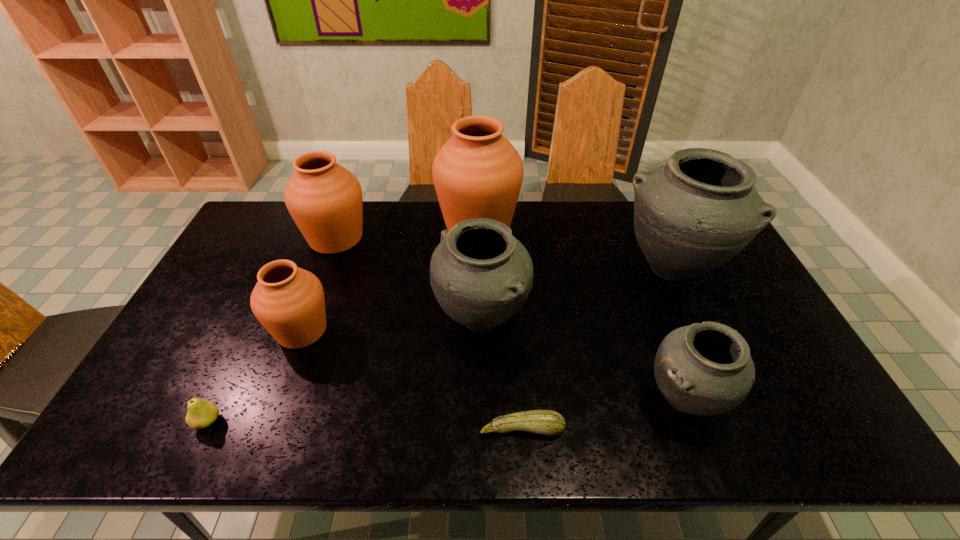
Identify the location of vacant point located between the second smallest brown urn and the biggest brown urn. Image resolution: width=960 pixels, height=540 pixels. (407, 232).

Locate an element on the screen. free space between the nearest black urn and the second biggest brown urn is located at coordinates (510, 319).

Where is `free point between the second biggest brown urn and the green zucchini`? The image size is (960, 540). free point between the second biggest brown urn and the green zucchini is located at coordinates (429, 334).

You are a GUI agent. You are given a task and a screenshot of the screen. Output one action in this format:
    pyautogui.click(x=<x>, y=<y>)
    Task: Click on the free spot between the pear and the leftmost black urn
    
    Given the screenshot: What is the action you would take?
    pyautogui.click(x=345, y=370)

Identify the location of object that can be found as the third closest to the smallest black urn. (481, 275).

Image resolution: width=960 pixels, height=540 pixels. I want to click on object that is the seventh closest to the second biggest brown urn, so click(x=705, y=369).

At what (x,y) coordinates should I click in order to perform the action: click on urn that stands as the closest to the second biggest brown urn. Please return your answer as a coordinate pair (x, y). Looking at the image, I should click on [x=288, y=301].

Identify which urn is the second closest to the biggest brown urn. Please provide its 2D coordinates. Your answer should be formatted as a tuple, i.e. [(x, y)], where the tuple contains the x and y coordinates of a point satisfying the conditions above.

[(324, 199)]

Locate which brown urn ranks second in proximity to the nearest brown urn. Please provide its 2D coordinates. Your answer should be formatted as a tuple, i.e. [(x, y)], where the tuple contains the x and y coordinates of a point satisfying the conditions above.

[(477, 173)]

Locate an element on the screen. Image resolution: width=960 pixels, height=540 pixels. brown urn that is the third closest to the second shortest object is located at coordinates (477, 173).